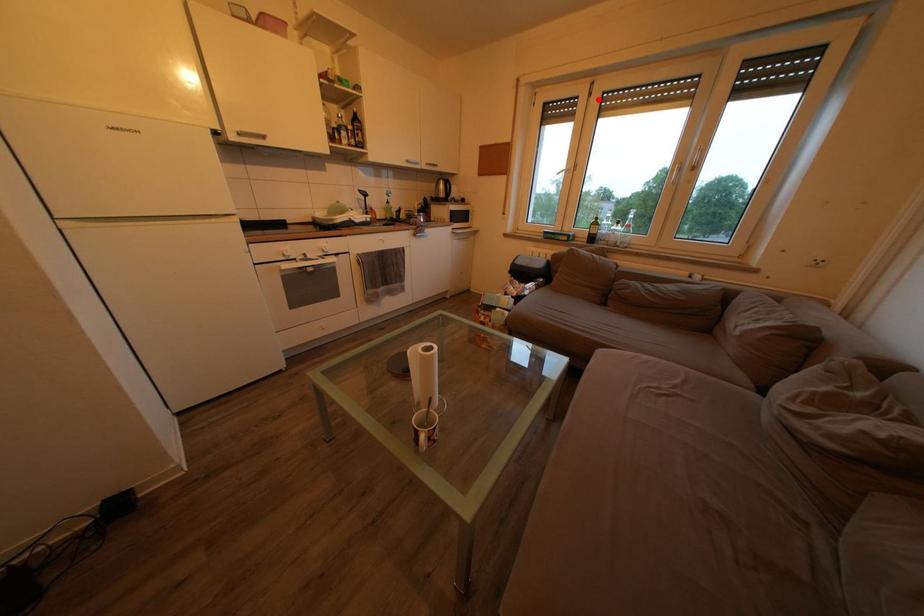
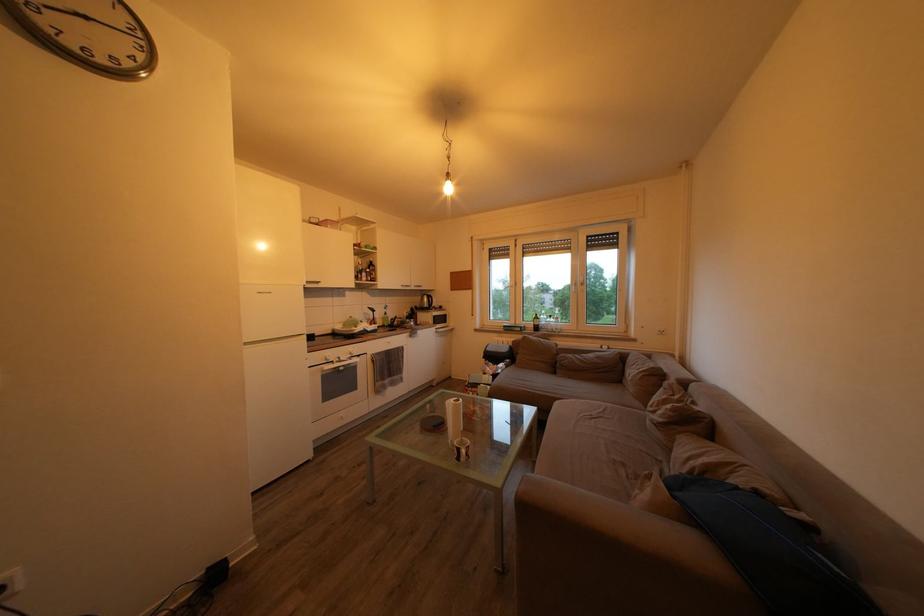
Question: I am providing you with two images of the same scene from different viewpoints. A red point is marked on the first image. Is the red point's position out of view in image 2?

Choices:
 (A) Yes
 (B) No

Answer: (B)